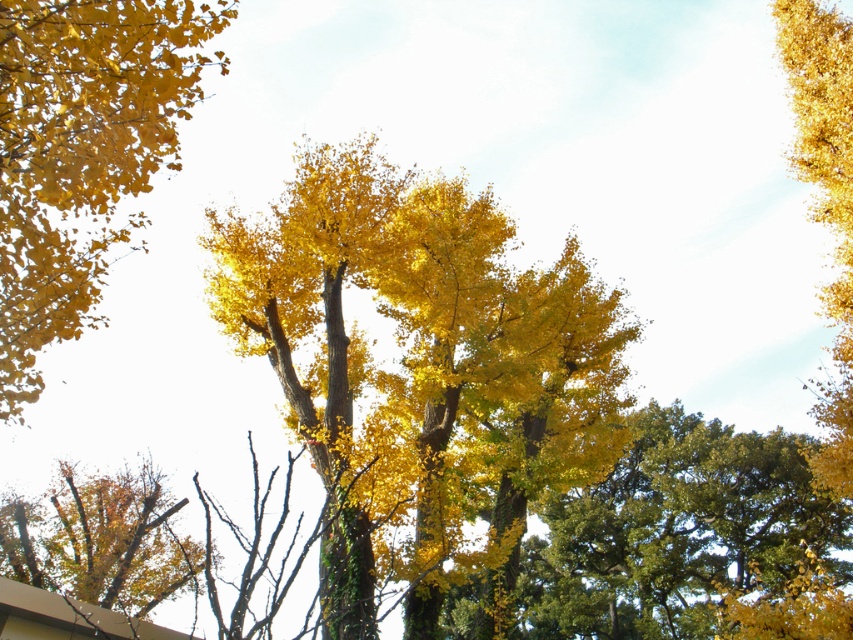
Is golden matte tree at center further to camera compared to golden leafy tree at right?

No, golden matte tree at center is closer to the viewer.

What do you see at coordinates (421, 371) in the screenshot? I see `golden matte tree at center` at bounding box center [421, 371].

Where is `golden matte tree at center`? This screenshot has width=853, height=640. golden matte tree at center is located at coordinates (421, 371).

Which of these two, yellow-green foliage at lower left or golden leafy tree at right, stands taller?

Standing taller between the two is golden leafy tree at right.

Does point (67, 529) come farther from viewer compared to point (844, 179)?

Yes, point (67, 529) is behind point (844, 179).

Is point (16, 545) more distant than point (827, 413)?

Yes.

Image resolution: width=853 pixels, height=640 pixels. Identify the location of yellow-green foliage at lower left. (x=100, y=540).

Which is above, golden matte tree at center or yellow-green foliage at lower left?

golden matte tree at center is higher up.

Is golden matte tree at center wider than yellow-green foliage at lower left?

No.

Does point (405, 241) lie behind point (177, 506)?

No, it is not.

Where is `golden matte tree at center`? The height and width of the screenshot is (640, 853). golden matte tree at center is located at coordinates pos(421,371).